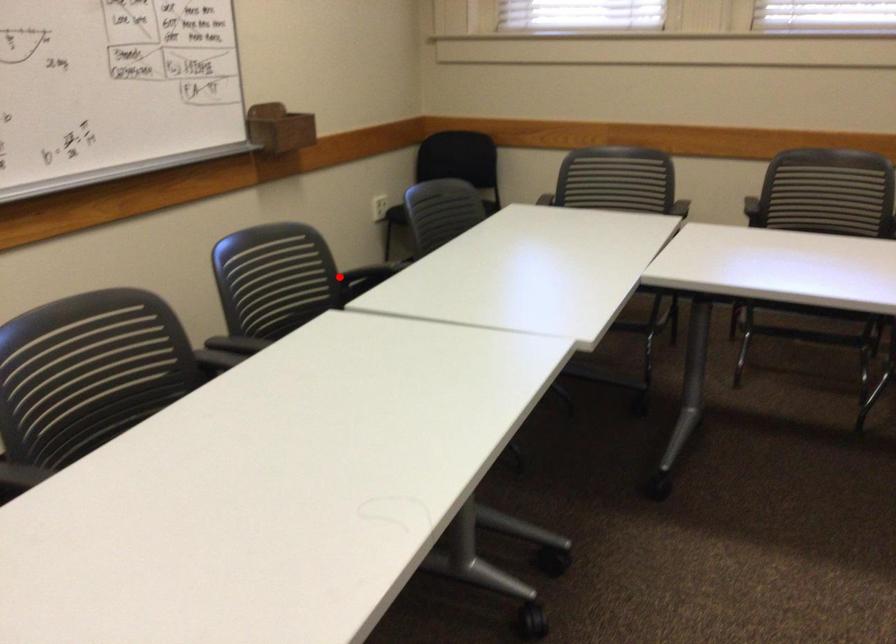
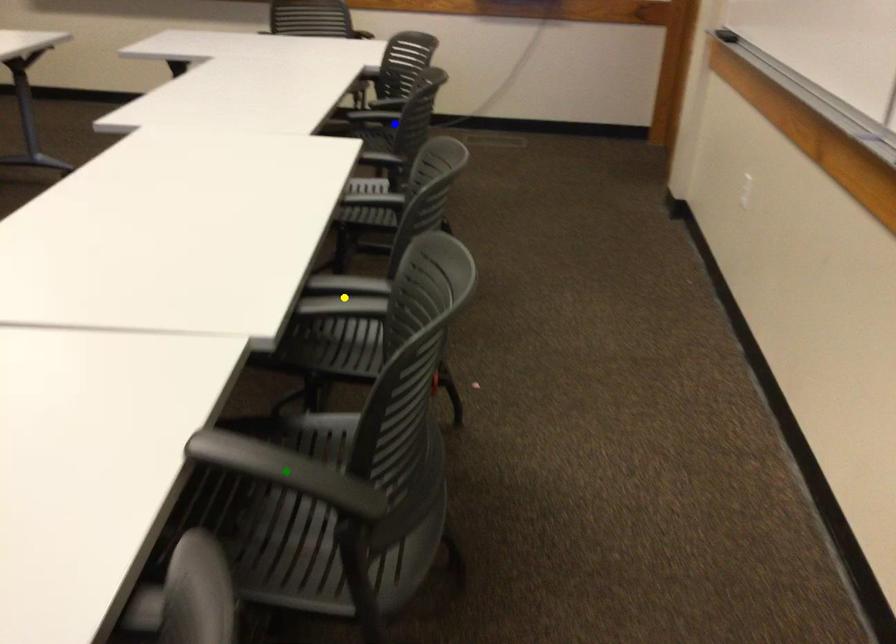
Question: I am providing you with two images of the same scene from different viewpoints. A red point is marked on the first image. You are given multiple points on the second image. Which point in image 2 is actually the same real-world point as the red point in image 1?

Choices:
 (A) blue point
 (B) yellow point
 (C) green point

Answer: (C)